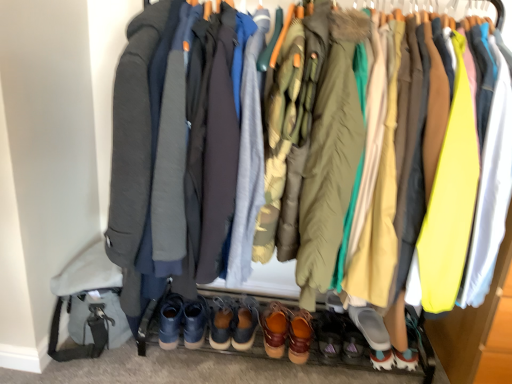
Image resolution: width=512 pixels, height=384 pixels. What are the coordinates of `brown suede shoes at center, the seventh footwear viewed from the right` in the screenshot? It's located at (221, 323).

How much space does leather boots at lower center, the 4th footwear when ordered from right to left, occupy horizontally?

leather boots at lower center, the 4th footwear when ordered from right to left, is 17.79 inches wide.

Image resolution: width=512 pixels, height=384 pixels. What do you see at coordinates (370, 327) in the screenshot?
I see `gray rubber slipper at lower center, arranged as the first footwear when viewed from the right` at bounding box center [370, 327].

The width and height of the screenshot is (512, 384). Identify the location of brown leather shoe at center, the 3th footwear in the right-to-left sequence. (300, 336).

The width and height of the screenshot is (512, 384). What do you see at coordinates (275, 329) in the screenshot? I see `brown leather shoes at center, which appears as the fifth footwear when viewed from the right` at bounding box center [275, 329].

Based on the photo, how much space does matte gray jacket at center, arranged as the second jacket when viewed from the right, occupy vertically?

The height of matte gray jacket at center, arranged as the second jacket when viewed from the right, is 4.68 feet.

The width and height of the screenshot is (512, 384). Describe the element at coordinates (106, 81) in the screenshot. I see `matte gray jacket at center, which ranks as the first jacket in left-to-right order` at that location.

In order to click on brown suede shoes at center, the seventh footwear viewed from the right in this screenshot , I will do `click(221, 323)`.

Is brown leather shoes at center, the 2th footwear positioned from the left, wider or thinner than camouflage fabric jacket at center, marked as the 2th robe in a right-to-left arrangement?

Considering their sizes, brown leather shoes at center, the 2th footwear positioned from the left, looks slimmer than camouflage fabric jacket at center, marked as the 2th robe in a right-to-left arrangement.

From a real-world perspective, is brown leather shoes at center, the 2th footwear positioned from the left, beneath camouflage fabric jacket at center, marked as the 2th robe in a right-to-left arrangement?

Yes, from a real-world perspective, brown leather shoes at center, the 2th footwear positioned from the left, is below camouflage fabric jacket at center, marked as the 2th robe in a right-to-left arrangement.

Locate an element on the screen. The width and height of the screenshot is (512, 384). footwear that is the 2nd object located below the camouflage fabric jacket at center, marked as the 2th robe in a right-to-left arrangement (from the image's perspective) is located at coordinates point(245,324).

Considering the relative positions of brown leather shoes at center, which ranks as the 6th footwear in right-to-left order, and camouflage fabric jacket at center, positioned as the second robe in left-to-right order, in the image provided, is brown leather shoes at center, which ranks as the 6th footwear in right-to-left order, behind camouflage fabric jacket at center, positioned as the second robe in left-to-right order,?

Yes.

Would you say brown suede shoes at center, the 1th footwear viewed from the left, is part of dark gray wool coat at center, which is counted as the 1th robe, starting from the left,'s contents?

No, dark gray wool coat at center, which is counted as the 1th robe, starting from the left, does not contain brown suede shoes at center, the 1th footwear viewed from the left.

Considering the relative sizes of dark gray wool coat at center, which is counted as the 1th robe, starting from the left, and brown suede shoes at center, the seventh footwear viewed from the right, in the image provided, is dark gray wool coat at center, which is counted as the 1th robe, starting from the left, wider than brown suede shoes at center, the seventh footwear viewed from the right,?

Correct, the width of dark gray wool coat at center, which is counted as the 1th robe, starting from the left, exceeds that of brown suede shoes at center, the seventh footwear viewed from the right.

From a real-world perspective, is dark gray wool coat at center, which appears as the third robe when viewed from the right, located beneath brown suede shoes at center, the 1th footwear viewed from the left?

Actually, dark gray wool coat at center, which appears as the third robe when viewed from the right, is physically above brown suede shoes at center, the 1th footwear viewed from the left, in the real world.

How many degrees apart are the facing directions of dark gray wool coat at center, which appears as the third robe when viewed from the right, and brown suede shoes at center, the 1th footwear viewed from the left?

They differ by 0.616 degrees in their facing directions.

Between camouflage fabric jacket at center, marked as the 2th robe in a right-to-left arrangement, and olive green puffer jacket at center, arranged as the 1th jacket when viewed from the right, which one is positioned in front?

olive green puffer jacket at center, arranged as the 1th jacket when viewed from the right, is more forward.

Between camouflage fabric jacket at center, marked as the 2th robe in a right-to-left arrangement, and olive green puffer jacket at center, arranged as the 1th jacket when viewed from the right, which one has less height?

camouflage fabric jacket at center, marked as the 2th robe in a right-to-left arrangement, is shorter.

Choose the correct answer: Is camouflage fabric jacket at center, marked as the 2th robe in a right-to-left arrangement, inside olive green puffer jacket at center, arranged as the 1th jacket when viewed from the right, or outside it?

camouflage fabric jacket at center, marked as the 2th robe in a right-to-left arrangement, lies outside olive green puffer jacket at center, arranged as the 1th jacket when viewed from the right.

From the image's perspective, is camouflage fabric jacket at center, positioned as the second robe in left-to-right order, above olive green puffer jacket at center, which is counted as the 2th jacket, starting from the left?

Yes, from the image's perspective, camouflage fabric jacket at center, positioned as the second robe in left-to-right order, is above olive green puffer jacket at center, which is counted as the 2th jacket, starting from the left.

From the picture: Is brown leather shoes at center, which ranks as the 6th footwear in right-to-left order, far from brown suede shoes at center, the 1th footwear viewed from the left?

No, brown leather shoes at center, which ranks as the 6th footwear in right-to-left order, is not far from brown suede shoes at center, the 1th footwear viewed from the left.

Considering the sizes of objects brown leather shoes at center, the 2th footwear positioned from the left, and brown suede shoes at center, the 1th footwear viewed from the left, in the image provided, who is shorter, brown leather shoes at center, the 2th footwear positioned from the left, or brown suede shoes at center, the 1th footwear viewed from the left,?

brown suede shoes at center, the 1th footwear viewed from the left.

Which object is more forward, brown leather shoes at center, which ranks as the 6th footwear in right-to-left order, or brown suede shoes at center, the seventh footwear viewed from the right?

Positioned in front is brown leather shoes at center, which ranks as the 6th footwear in right-to-left order.

Is camouflage fabric jacket at center, positioned as the second robe in left-to-right order, placed right next to gray rubber slipper at lower center, arranged as the first footwear when viewed from the right?

No, camouflage fabric jacket at center, positioned as the second robe in left-to-right order, is not beside gray rubber slipper at lower center, arranged as the first footwear when viewed from the right.

Is camouflage fabric jacket at center, positioned as the second robe in left-to-right order, closer to the viewer compared to gray rubber slipper at lower center, arranged as the first footwear when viewed from the right?

Yes.

This screenshot has width=512, height=384. Identify the location of the 5th footwear counting from the right side of the camouflage fabric jacket at center, marked as the 2th robe in a right-to-left arrangement. (370, 327).

Considering the sizes of objects camouflage fabric jacket at center, positioned as the second robe in left-to-right order, and gray rubber slipper at lower center, arranged as the first footwear when viewed from the right, in the image provided, who is smaller, camouflage fabric jacket at center, positioned as the second robe in left-to-right order, or gray rubber slipper at lower center, arranged as the first footwear when viewed from the right,?

Smaller between the two is gray rubber slipper at lower center, arranged as the first footwear when viewed from the right.

Consider the image. Which object is closer to the camera taking this photo, gray rubber slipper at lower center, arranged as the first footwear when viewed from the right, or dark gray wool coat at center, which is counted as the 1th robe, starting from the left?

dark gray wool coat at center, which is counted as the 1th robe, starting from the left, is more forward.

Is gray rubber slipper at lower center, arranged as the first footwear when viewed from the right, turned away from dark gray wool coat at center, which is counted as the 1th robe, starting from the left?

That's not correct — gray rubber slipper at lower center, arranged as the first footwear when viewed from the right, is not looking away from dark gray wool coat at center, which is counted as the 1th robe, starting from the left.

Between gray rubber slipper at lower center, the seventh footwear from the left, and dark gray wool coat at center, which appears as the third robe when viewed from the right, which one has smaller width?

gray rubber slipper at lower center, the seventh footwear from the left.

From a real-world perspective, is brown leather shoes at center, the 3th footwear positioned from the left, under matte yellow fabric at right, arranged as the 1th robe when viewed from the right?

Yes, from a real-world perspective, brown leather shoes at center, the 3th footwear positioned from the left, is under matte yellow fabric at right, arranged as the 1th robe when viewed from the right.

Is brown leather shoes at center, the 3th footwear positioned from the left, in front of or behind matte yellow fabric at right, arranged as the 1th robe when viewed from the right, in the image?

brown leather shoes at center, the 3th footwear positioned from the left, is positioned farther from the viewer than matte yellow fabric at right, arranged as the 1th robe when viewed from the right.

Can you confirm if brown leather shoes at center, which appears as the fifth footwear when viewed from the right, is shorter than matte yellow fabric at right, marked as the third robe in a left-to-right arrangement?

Yes, brown leather shoes at center, which appears as the fifth footwear when viewed from the right, is shorter than matte yellow fabric at right, marked as the third robe in a left-to-right arrangement.

Is point (265, 347) closer or farther from the camera than point (473, 136)?

Point (265, 347).

I want to click on the 1st footwear to the left of the camouflage fabric jacket at center, positioned as the second robe in left-to-right order, counting from the anchor's position, so click(245, 324).

What are the coordinates of `the 2nd robe in front of the brown suede shoes at center, the seventh footwear viewed from the right` in the screenshot? It's located at (219, 153).

When comparing their distances from gray rubber slipper at lower center, the seventh footwear from the left, does leather boots at lower center, the 4th footwear when ordered from right to left, or dark gray wool coat at center, which appears as the third robe when viewed from the right, seem further?

The object further to gray rubber slipper at lower center, the seventh footwear from the left, is dark gray wool coat at center, which appears as the third robe when viewed from the right.

When comparing their distances from leather boots at lower center, which appears as the 4th footwear when viewed from the left, does olive green puffer jacket at center, which is counted as the 2th jacket, starting from the left, or brown leather shoes at center, which appears as the fifth footwear when viewed from the right, seem further?

olive green puffer jacket at center, which is counted as the 2th jacket, starting from the left, is positioned further to the anchor leather boots at lower center, which appears as the 4th footwear when viewed from the left.

Based on their spatial positions, is gray rubber slipper at lower center, arranged as the first footwear when viewed from the right, or matte gray jacket at center, which ranks as the first jacket in left-to-right order, further from brown leather shoes at center, the 2th footwear positioned from the left?

Based on the image, matte gray jacket at center, which ranks as the first jacket in left-to-right order, appears to be further to brown leather shoes at center, the 2th footwear positioned from the left.

Looking at the image, which one is located closer to olive green puffer jacket at center, which is counted as the 2th jacket, starting from the left, gray rubber slipper at lower center, arranged as the first footwear when viewed from the right, or matte yellow fabric at right, arranged as the 1th robe when viewed from the right?

Among the two, matte yellow fabric at right, arranged as the 1th robe when viewed from the right, is located nearer to olive green puffer jacket at center, which is counted as the 2th jacket, starting from the left.

From the picture: Estimate the real-world distances between objects in this image. Which object is closer to matte gray shoe at lower center, which is the 2th footwear from right to left, olive green puffer jacket at center, which is counted as the 2th jacket, starting from the left, or brown leather shoe at center, the 3th footwear in the right-to-left sequence?

The object closer to matte gray shoe at lower center, which is the 2th footwear from right to left, is brown leather shoe at center, the 3th footwear in the right-to-left sequence.

Based on their spatial positions, is brown leather shoe at center, the 3th footwear in the right-to-left sequence, or leather boots at lower center, the 4th footwear when ordered from right to left, further from gray rubber slipper at lower center, arranged as the first footwear when viewed from the right?

Among the two, leather boots at lower center, the 4th footwear when ordered from right to left, is located further to gray rubber slipper at lower center, arranged as the first footwear when viewed from the right.

In the scene shown: Estimate the real-world distances between objects in this image. Which object is closer to olive green puffer jacket at center, which is counted as the 2th jacket, starting from the left, brown leather shoes at center, the 3th footwear positioned from the left, or matte gray shoe at lower center, placed as the 6th footwear when sorted from left to right?

The object closer to olive green puffer jacket at center, which is counted as the 2th jacket, starting from the left, is matte gray shoe at lower center, placed as the 6th footwear when sorted from left to right.

Considering their positions, is olive green puffer jacket at center, which is counted as the 2th jacket, starting from the left, positioned closer to matte gray shoe at lower center, placed as the 6th footwear when sorted from left to right, than dark gray wool coat at center, which appears as the third robe when viewed from the right?

Among the two, olive green puffer jacket at center, which is counted as the 2th jacket, starting from the left, is located nearer to matte gray shoe at lower center, placed as the 6th footwear when sorted from left to right.

Image resolution: width=512 pixels, height=384 pixels. I want to click on footwear that lies between dark gray wool coat at center, which is counted as the 1th robe, starting from the left, and brown leather shoes at center, the 2th footwear positioned from the left, from top to bottom, so click(x=221, y=323).

Identify the location of jacket between olive green puffer jacket at center, which is counted as the 2th jacket, starting from the left, and gray rubber slipper at lower center, arranged as the first footwear when viewed from the right, vertically. The image size is (512, 384). (106, 81).

You are a GUI agent. You are given a task and a screenshot of the screen. Output one action in this format:
    pyautogui.click(x=<x>, y=<y>)
    Task: Click on the robe between camouflage fabric jacket at center, positioned as the second robe in left-to-right order, and brown leather shoe at center, the 3th footwear in the right-to-left sequence, vertically
    
    Given the screenshot: What is the action you would take?
    pyautogui.click(x=450, y=198)

I want to click on footwear between brown leather shoe at center, which ranks as the 5th footwear in left-to-right order, and gray rubber slipper at lower center, the seventh footwear from the left, in the horizontal direction, so click(x=352, y=343).